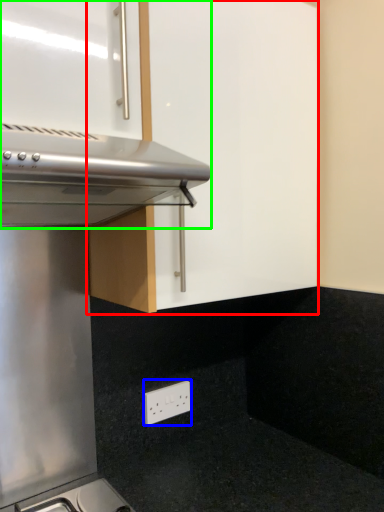
Question: Which is farther away from cabinetry (highlighted by a red box)? electric outlet (highlighted by a blue box) or oven (highlighted by a green box)?

Choices:
 (A) electric outlet
 (B) oven

Answer: (A)